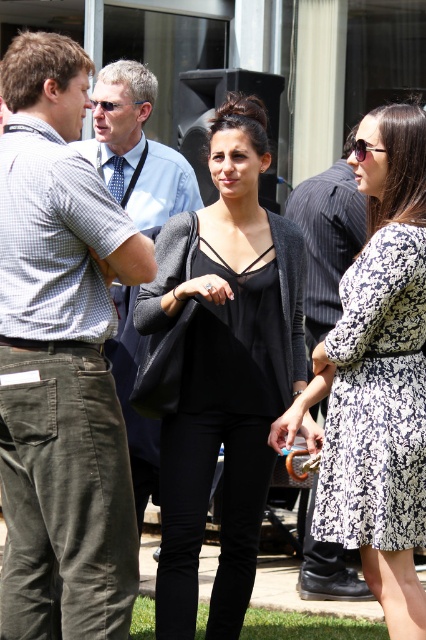
Question: Which object appears farthest from the camera in this image?

Choices:
 (A) black pinstripe shirt at center
 (B) shiny black sunglasses at upper right
 (C) black floral dress at right

Answer: (A)

Question: Observing the image, what is the correct spatial positioning of light blue shirt at center in reference to black pinstripe shirt at center?

Choices:
 (A) above
 (B) below

Answer: (A)

Question: Can you confirm if light blue shirt at center is bigger than black pinstripe shirt at center?

Choices:
 (A) yes
 (B) no

Answer: (A)

Question: Estimate the real-world distances between objects in this image. Which object is farther from the matte blue sunglasses at upper left?

Choices:
 (A) checkered fabric shirt at left
 (B) black floral dress at right
 (C) shiny black sunglasses at upper right

Answer: (B)

Question: Estimate the real-world distances between objects in this image. Which object is closer to the black floral dress at right?

Choices:
 (A) matte blue sunglasses at upper left
 (B) shiny black sunglasses at upper right
 (C) black pinstripe shirt at center

Answer: (B)

Question: From the image, what is the correct spatial relationship of black floral dress at right in relation to matte blue sunglasses at upper left?

Choices:
 (A) below
 (B) above

Answer: (A)